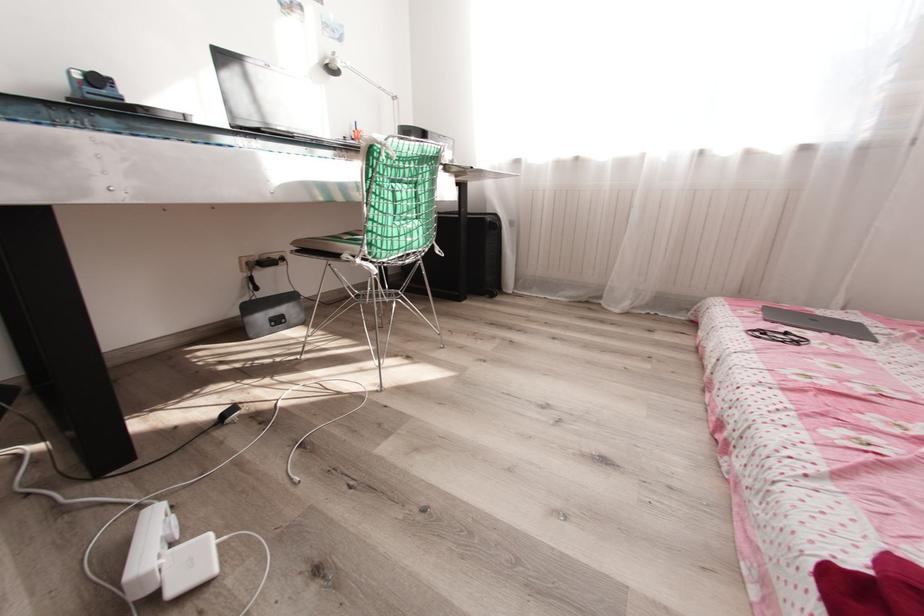
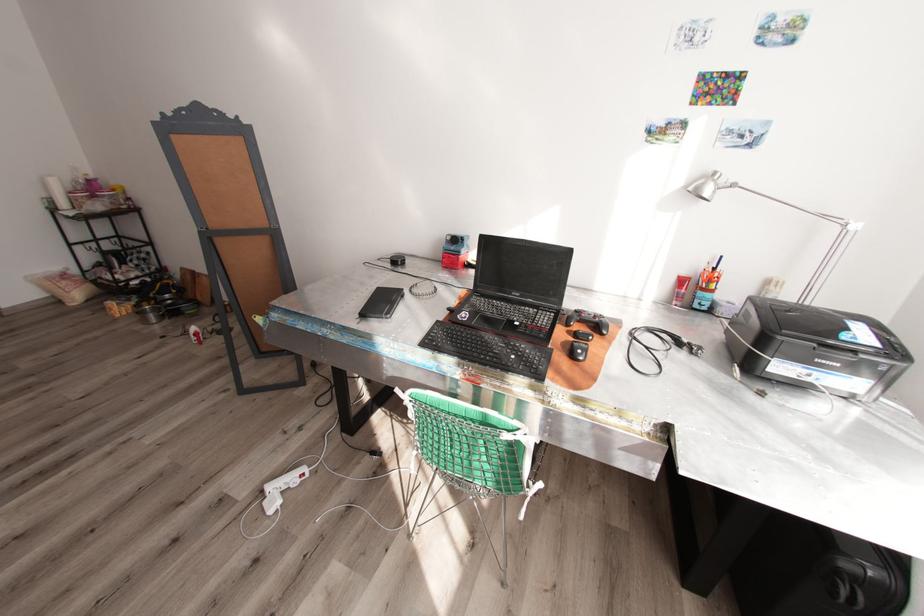
Locate, in the second image, the point that corresponds to [331,63] in the first image.

(695, 188)